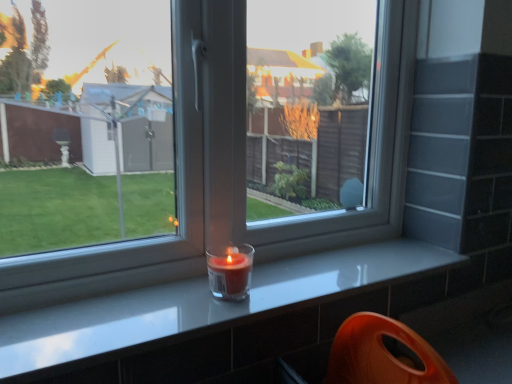
The image size is (512, 384). Identify the location of vacant space that is to the left of translucent glass candle at window. (155, 288).